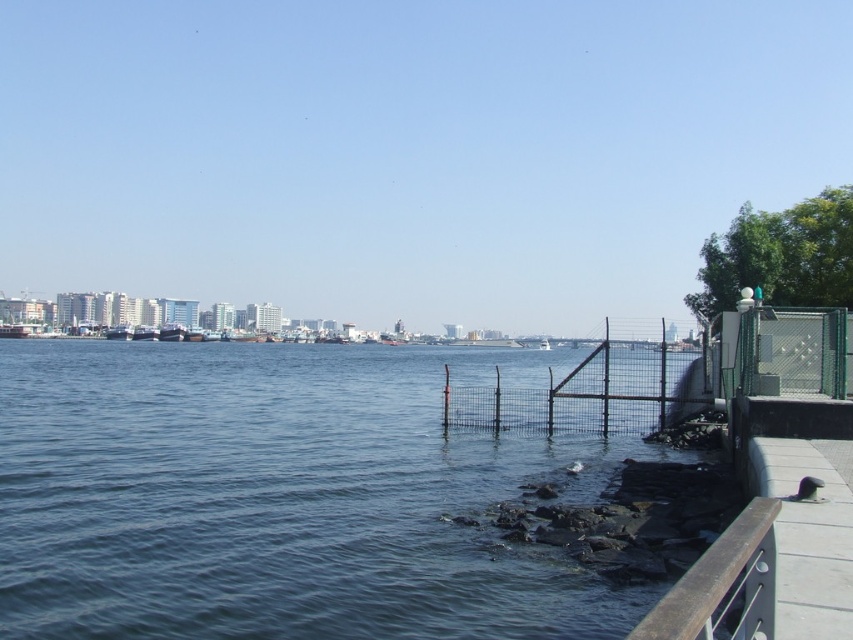
Between blue water at lower left and black wire fence at center, which one is positioned higher?

Positioned higher is black wire fence at center.

Who is more forward, (73, 602) or (556, 392)?

Point (73, 602) is in front.

Is point (434, 355) positioned in front of point (461, 390)?

No.

Locate an element on the screen. The height and width of the screenshot is (640, 853). blue water at lower left is located at coordinates (282, 497).

Is black wire fence at center shorter than brown wooden rail at lower right?

No, black wire fence at center is not shorter than brown wooden rail at lower right.

Between black wire fence at center and brown wooden rail at lower right, which one has less height?

Standing shorter between the two is brown wooden rail at lower right.

Describe the element at coordinates (587, 392) in the screenshot. I see `black wire fence at center` at that location.

I want to click on black wire fence at center, so click(x=587, y=392).

Is blue water at lower left smaller than brown wooden rail at lower right?

No.

Who is more distant from viewer, (265, 419) or (718, 563)?

Point (265, 419)

You are a GUI agent. You are given a task and a screenshot of the screen. Output one action in this format:
    pyautogui.click(x=<x>, y=<y>)
    Task: Click on the blue water at lower left
    The width and height of the screenshot is (853, 640).
    Given the screenshot: What is the action you would take?
    pyautogui.click(x=282, y=497)